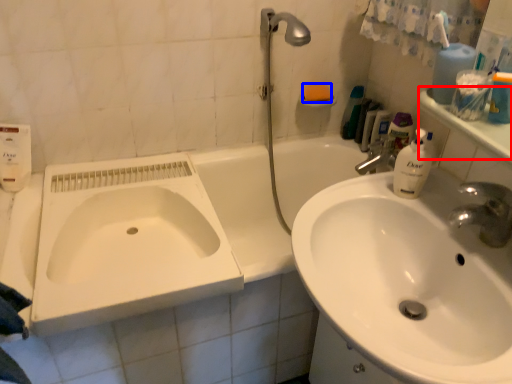
Question: Which of the following is the farthest to the observer, counter top (highlighted by a red box) or soap (highlighted by a blue box)?

Choices:
 (A) counter top
 (B) soap

Answer: (B)